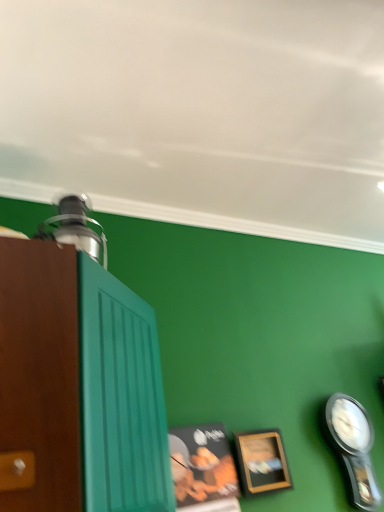
Question: Does point (208, 488) appear closer or farther from the camera than point (246, 433)?

Choices:
 (A) farther
 (B) closer

Answer: (B)

Question: From a real-world perspective, relative to wooden picture frame at lower right, positioned as the second picture frame in left-to-right order, is wooden picture frame at lower center, the 2th picture frame in the right-to-left sequence, vertically above or below?

Choices:
 (A) below
 (B) above

Answer: (A)

Question: Which is nearer to the brown wood cabinet at left?

Choices:
 (A) wooden picture frame at lower right, positioned as the second picture frame in left-to-right order
 (B) black plastic clock at lower right
 (C) wooden picture frame at lower center, the 2th picture frame in the right-to-left sequence

Answer: (C)

Question: Estimate the real-world distances between objects in this image. Which object is closer to the brown wood cabinet at left?

Choices:
 (A) wooden picture frame at lower right, the first picture frame in the right-to-left sequence
 (B) wooden picture frame at lower center, the 2th picture frame in the right-to-left sequence
 (C) black plastic clock at lower right

Answer: (B)